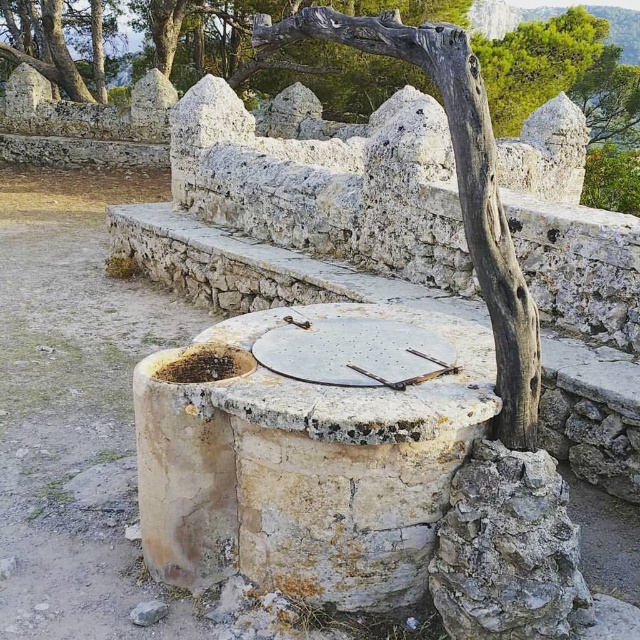
You are an architect designing a new garden and want to incorporate elements from this historical well scene. If you need to place both the smooth gray stone wall at upper center and the gray rough tree trunk at center in your design, which element should you allocate more space for based on their sizes?

The smooth gray stone wall at upper center is bigger than the gray rough tree trunk at center, so you should allocate more space for the smooth gray stone wall at upper center in your design.

You are a painter standing at the base of the gray rough tree trunk at center and want to paint the smooth gray stone wall at upper center. Can you reach it without climbing any objects?

The smooth gray stone wall at upper center is above the gray rough tree trunk at center, so you can reach it by climbing the tree trunk.